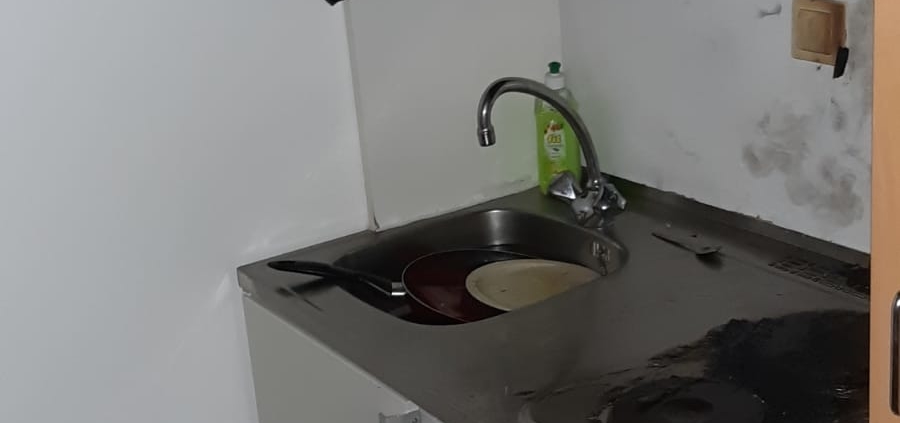
Find the location of a particular element. green dish soap is located at coordinates (549, 138).